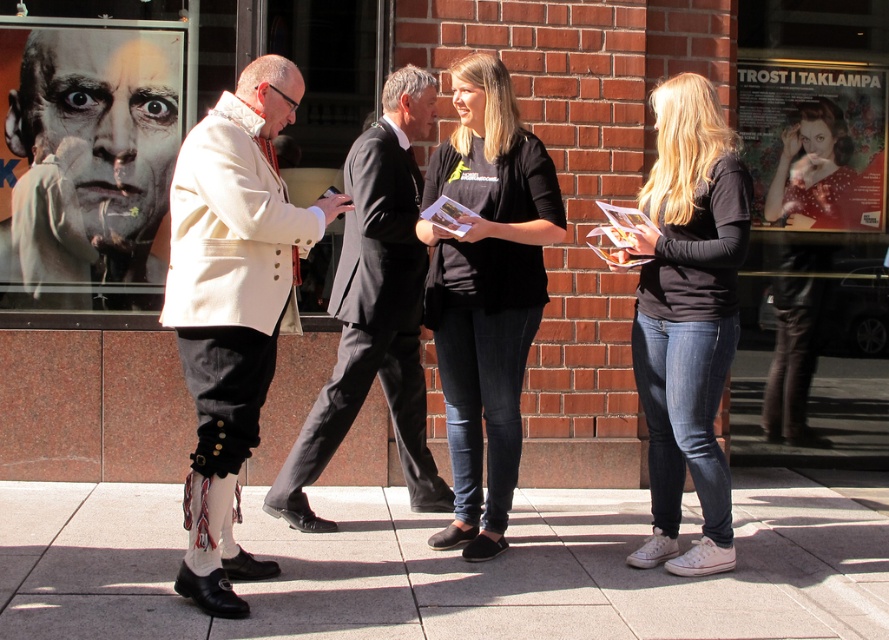
You are a photographer standing in front of the scene. You want to take a photo that includes both the black cotton shirt at center and the matte red poster at upper right. Which object will appear larger in the photo?

The black cotton shirt at center will appear larger in the photo because it is closer to the viewer than the matte red poster at upper right.